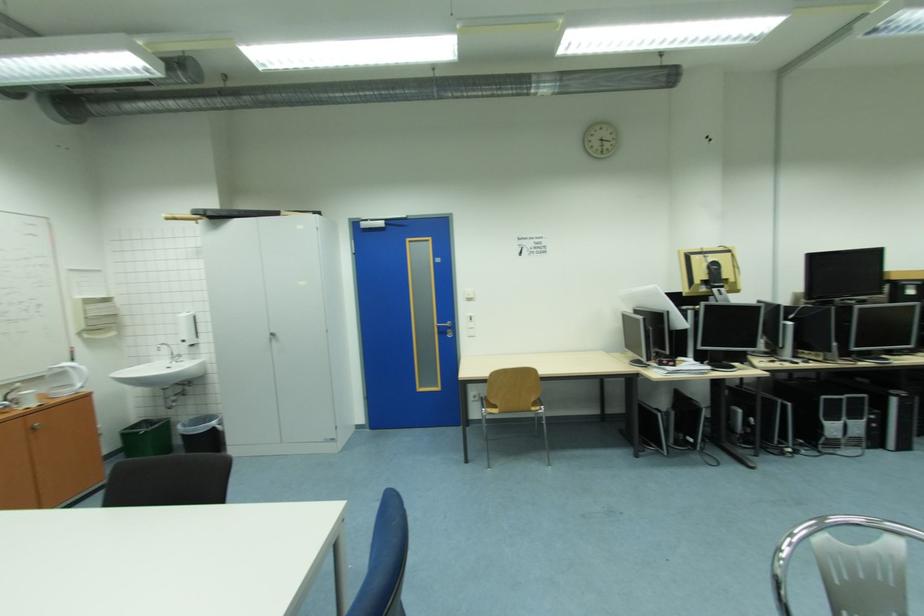
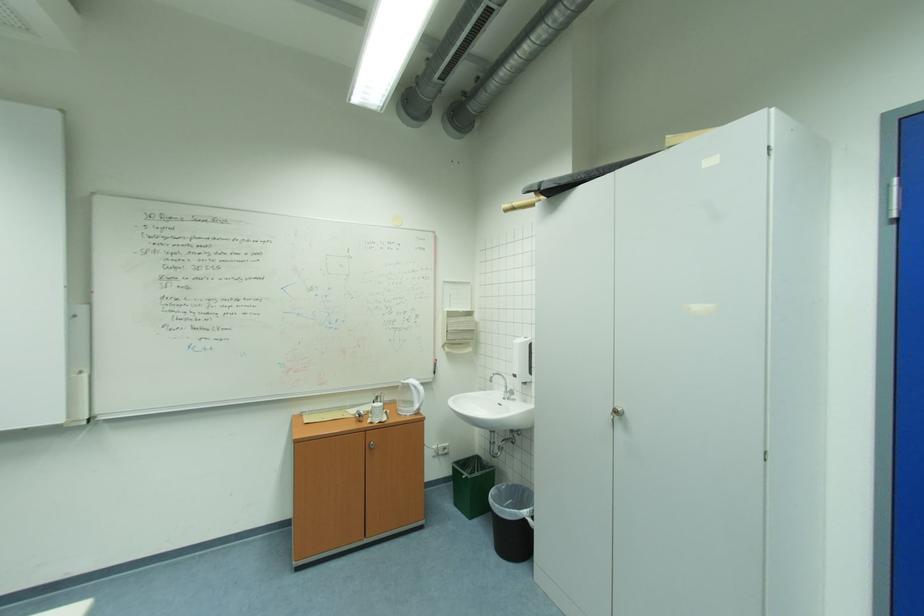
Where in the second image is the point corresponding to the point at 70,395 from the first image?

(415, 411)